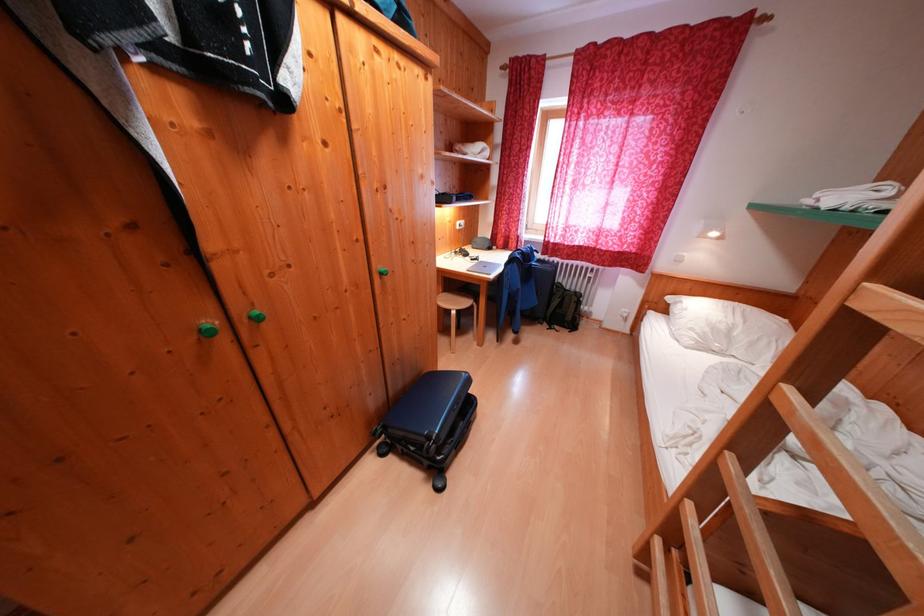
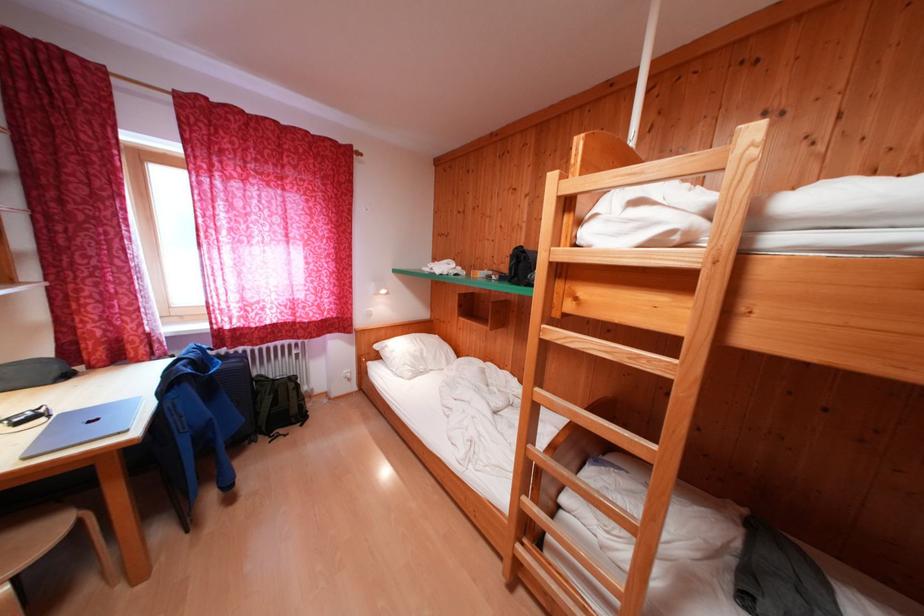
The point at (568, 291) is marked in the first image. Where is the corresponding point in the second image?

(271, 383)